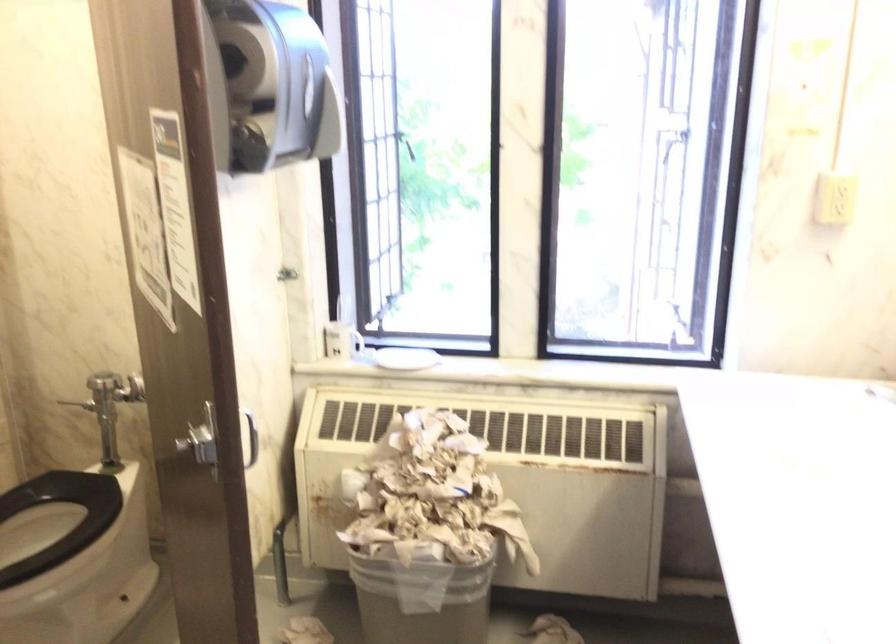
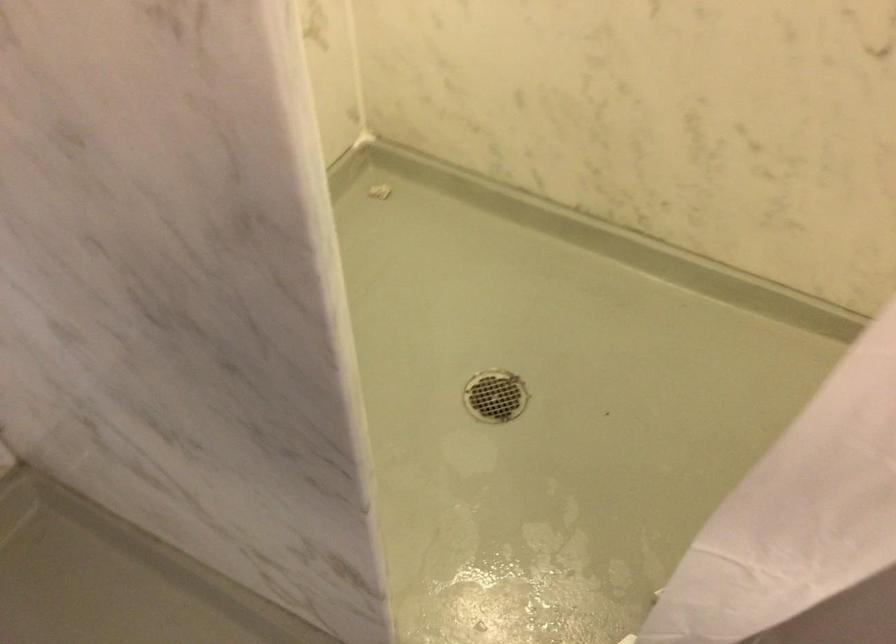
The first image is from the beginning of the video and the second image is from the end. How did the camera likely rotate when shooting the video?

The rotation direction of the camera is left-down.